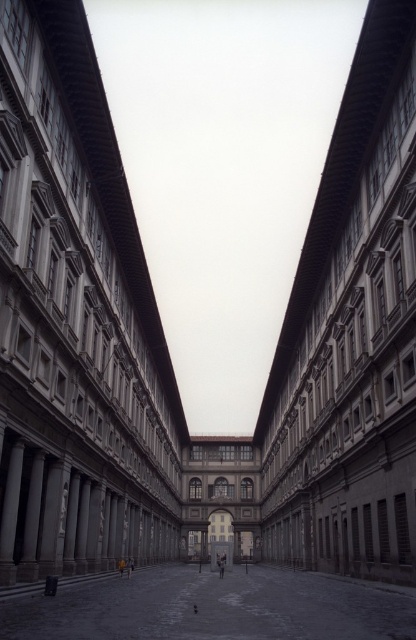
How far apart are matte gray building at center and smooth stone courtyard at center?

matte gray building at center and smooth stone courtyard at center are 88.16 feet apart.

Is point (133, 484) in front of point (200, 579)?

That is False.

Is point (156, 538) positioned after point (84, 604)?

That is True.

What are the coordinates of `matte gray building at center` in the screenshot? It's located at (76, 321).

How distant is matte gray building at center from gray stone building at center?

matte gray building at center and gray stone building at center are 45.42 meters apart from each other.

In the scene shown: Can you confirm if matte gray building at center is smaller than gray stone building at center?

Yes.

Between point (148, 330) and point (331, 547), which one is positioned behind?

The point (148, 330) is behind.

In order to click on matte gray building at center in this screenshot , I will do `click(76, 321)`.

Can you confirm if gray stone building at center is positioned to the left of smooth stone courtyard at center?

In fact, gray stone building at center is to the right of smooth stone courtyard at center.

Who is more forward, [349,472] or [101,620]?

Point [101,620] is more forward.

Is point (275, 381) farther from viewer compared to point (356, 609)?

Yes, point (275, 381) is behind point (356, 609).

At what (x,y) coordinates should I click in order to perform the action: click on gray stone building at center. Please return your answer as a coordinate pair (x, y). Looking at the image, I should click on (351, 336).